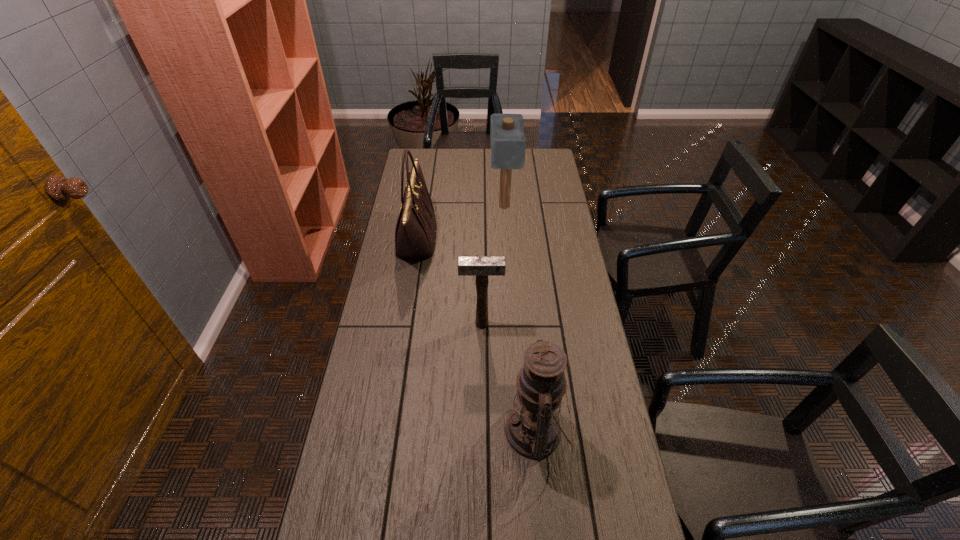
Locate an element on the screen. The width and height of the screenshot is (960, 540). empty space between the handbag and the taller mallet is located at coordinates (460, 222).

Find the location of a particular element. The width and height of the screenshot is (960, 540). object that ranks as the closest to the shortest object is located at coordinates point(415,233).

You are a GUI agent. You are given a task and a screenshot of the screen. Output one action in this format:
    pyautogui.click(x=<x>, y=<y>)
    Task: Click on the object that is the closest to the handbag
    The image size is (960, 540).
    Given the screenshot: What is the action you would take?
    (x=508, y=142)

Identify which mallet is the nearest to the handbag. Please provide its 2D coordinates. Your answer should be formatted as a tuple, i.e. [(x, y)], where the tuple contains the x and y coordinates of a point satisfying the conditions above.

[(508, 142)]

Find the location of `vacant space that satisfies the following two spatial constraints: 1. on the back side of the third farthest object; 2. on the left side of the farther mallet`. vacant space that satisfies the following two spatial constraints: 1. on the back side of the third farthest object; 2. on the left side of the farther mallet is located at coordinates (481, 206).

Where is `vacant area that satisfies the following two spatial constraints: 1. on the front-facing side of the shortest object; 2. on the right side of the handbag`? This screenshot has width=960, height=540. vacant area that satisfies the following two spatial constraints: 1. on the front-facing side of the shortest object; 2. on the right side of the handbag is located at coordinates (403, 324).

Locate an element on the screen. free space that satisfies the following two spatial constraints: 1. on the back side of the shorter mallet; 2. on the front-facing side of the leftmost object is located at coordinates (481, 239).